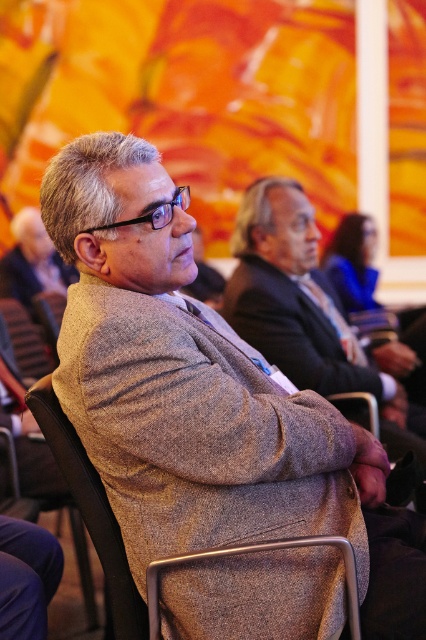
You are organizing a photo shoot and need to arrange two models wearing the textured gray blazer at center and the textured wool coat at center. Based on their positions in the image, which model should stand closer to the camera to maintain the original spatial relationship?

The model wearing the textured gray blazer at center should stand closer to the camera since it was originally positioned further to the viewer compared to the textured wool coat at center.

You are standing in the conference room and see two points marked in the image. Which point is closer to you, point (293, 358) or point (37, 272)?

Point (293, 358) is closer to the viewer than point (37, 272).

You are a photographer setting up a camera to capture the two men in the foreground of the conference scene. The camera has a limited frame width. If you want to include both the gray woolen suit at center and the matte gray coat at center in the shot without cropping either, which object should you position closer to the center of the frame to ensure they both fit?

You should position the gray woolen suit at center closer to the center of the frame since it might be wider than the matte gray coat at center, allowing both to fit within the camera frame without cropping.